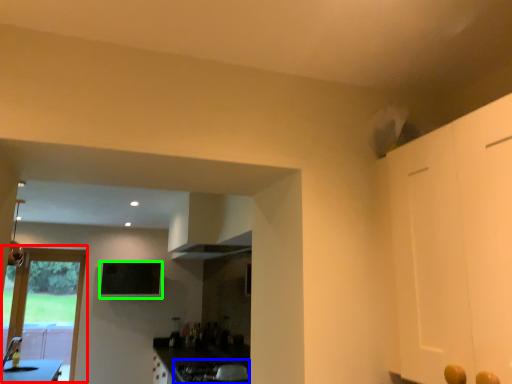
Question: Which object is positioned closest to door (highlighted by a red box)? Select from gas stove (highlighted by a blue box) and window screen (highlighted by a green box).

Choices:
 (A) gas stove
 (B) window screen

Answer: (B)